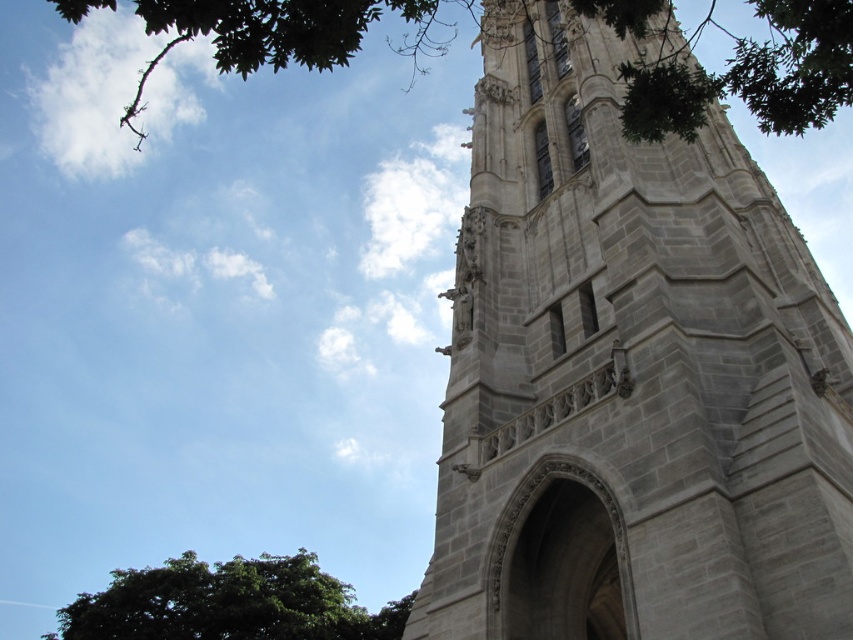
You are standing in front of the grand stone tower and notice two points marked on the tower. One is at coordinate point (257, 32) and the other at point (113, 588). Which point is nearer to you?

Point (257, 32) is closer to the viewer than point (113, 588).